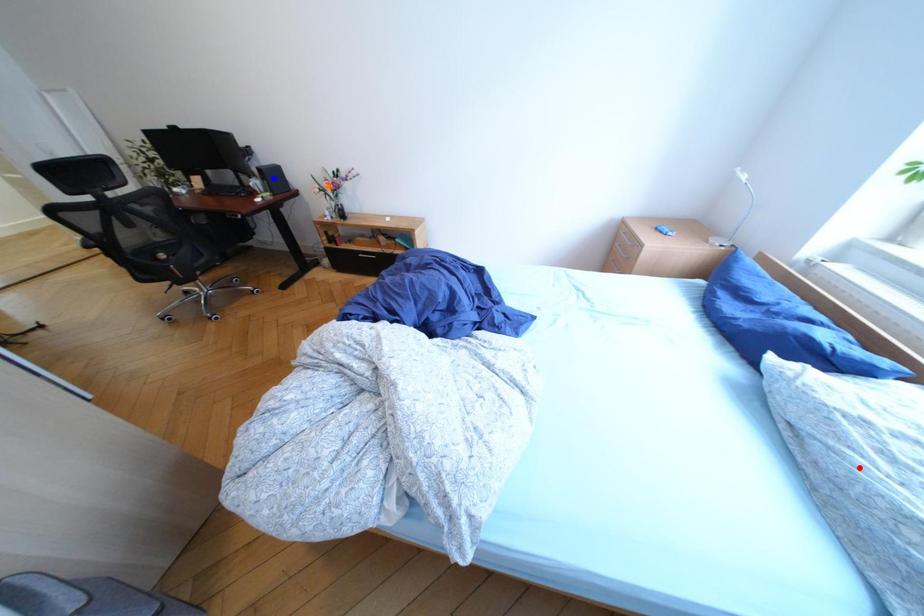
Question: In the image, two points are highlighted. Which point is nearer to the camera? Reply with the corresponding letter.

Choices:
 (A) blue point
 (B) red point

Answer: (B)